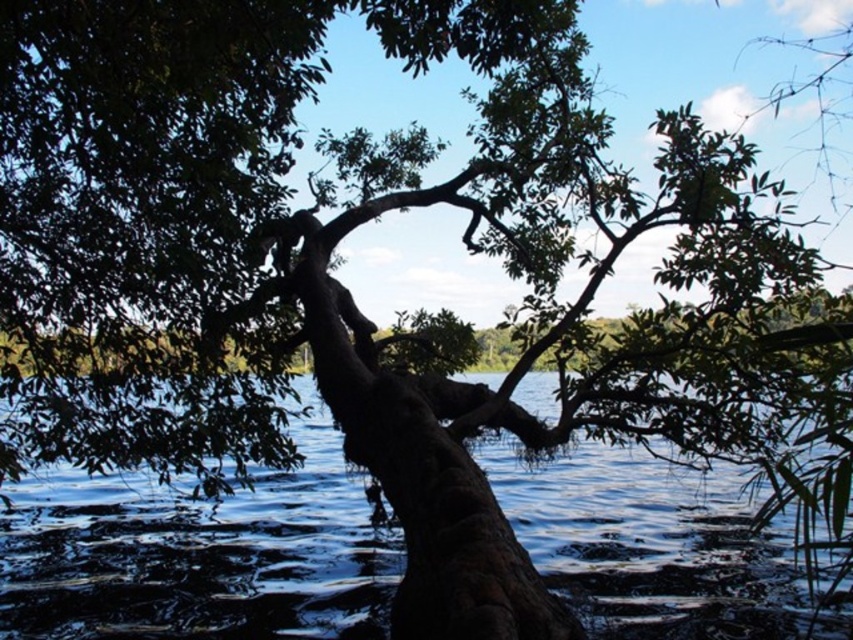
Does dark blue water at center have a smaller size compared to brown rough tree trunk at center?

Yes.

Who is positioned more to the right, dark blue water at center or brown rough tree trunk at center?

From the viewer's perspective, brown rough tree trunk at center appears more on the right side.

Is point (776, 596) positioned before point (450, 387)?

That is True.

Where is `dark blue water at center`? This screenshot has height=640, width=853. dark blue water at center is located at coordinates (199, 556).